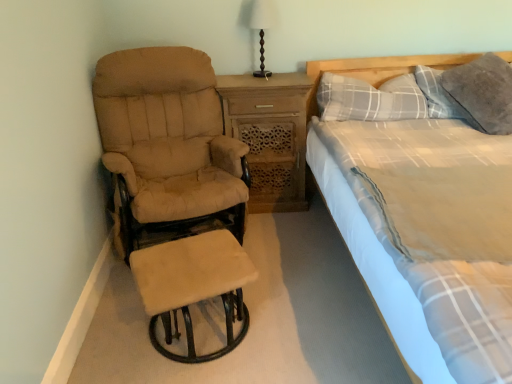
You are a GUI agent. You are given a task and a screenshot of the screen. Output one action in this format:
    pyautogui.click(x=<x>, y=<y>)
    Task: Click on the blank space to the left of beige suede stool at lower left
    
    Given the screenshot: What is the action you would take?
    pyautogui.click(x=118, y=337)